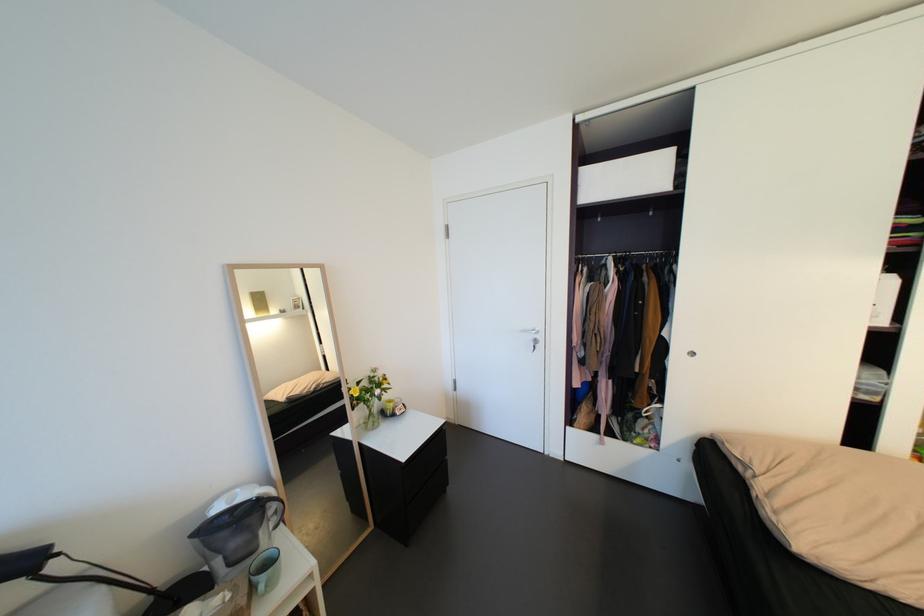
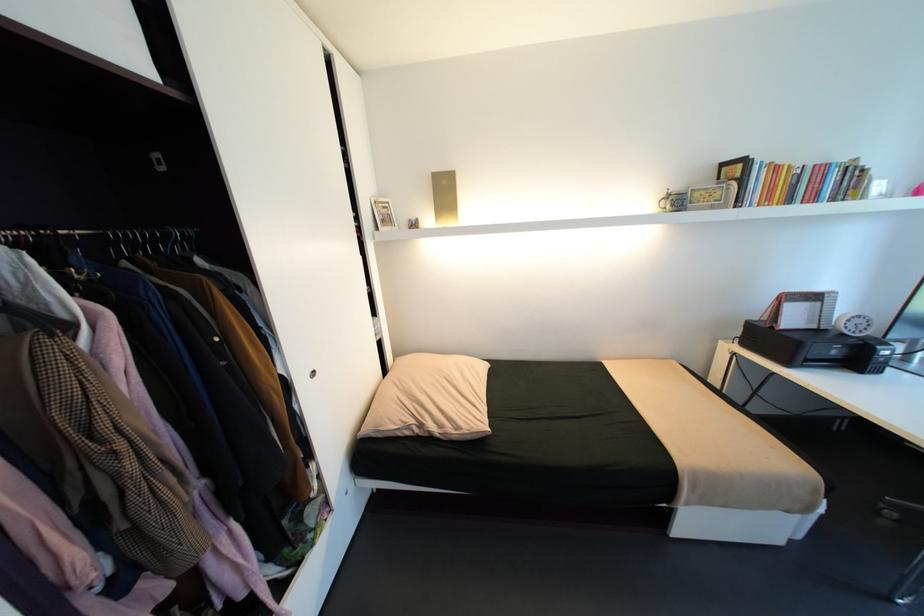
Find the pixel in the second image that matches point 747,468 in the first image.

(415, 432)